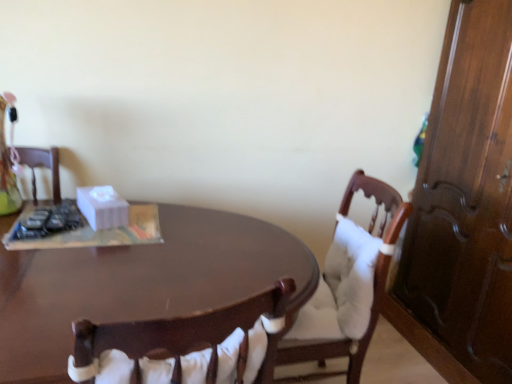
Question: Is white matte tissue box at center to the left or to the right of wooden chair with white cushion at center in the image?

Choices:
 (A) right
 (B) left

Answer: (B)

Question: From their relative heights in the image, would you say white matte tissue box at center is taller or shorter than wooden chair with white cushion at center?

Choices:
 (A) short
 (B) tall

Answer: (A)

Question: Estimate the real-world distances between objects in this image. Which object is farther from the white matte tissue box at center?

Choices:
 (A) wooden chair with white cushion at center
 (B) shiny brown desk at center

Answer: (A)

Question: Based on their relative distances, which object is farther from the white matte tissue box at center?

Choices:
 (A) wooden chair with white cushion at center
 (B) shiny brown desk at center

Answer: (A)